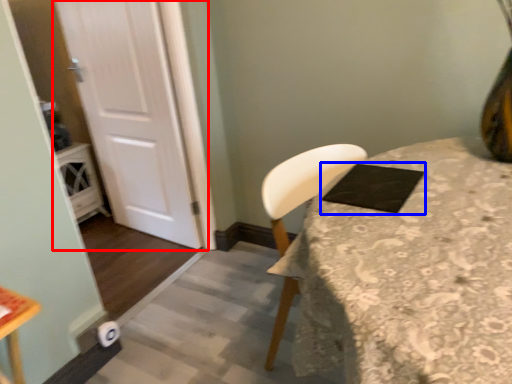
Question: Which point is closer to the camera, door (highlighted by a red box) or pad (highlighted by a blue box)?

Choices:
 (A) door
 (B) pad

Answer: (B)